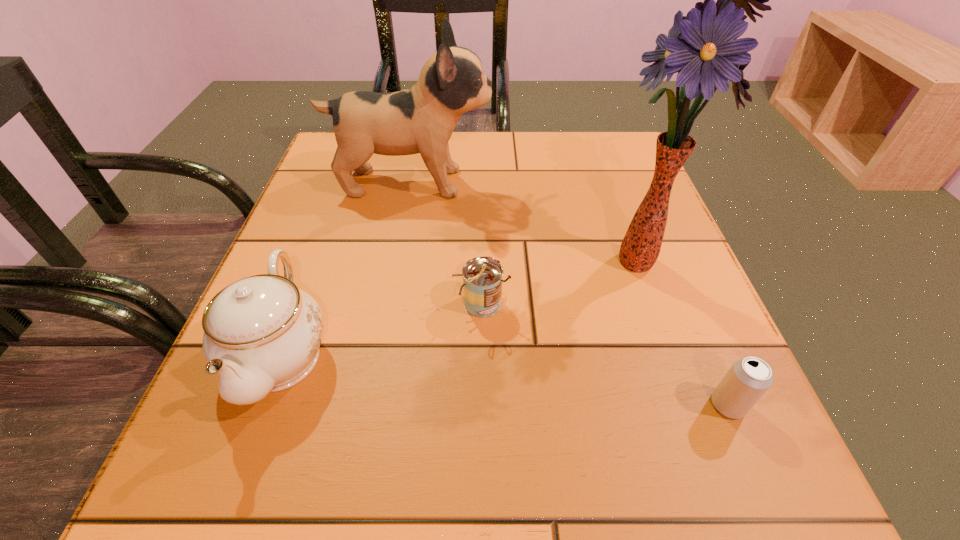
Locate an element on the screen. flower arrangement is located at coordinates (703, 48).

The image size is (960, 540). In order to click on puppy in this screenshot , I will do `click(421, 120)`.

Identify the location of the second tallest object. (421, 120).

Locate an element on the screen. This screenshot has width=960, height=540. chinaware is located at coordinates (262, 334).

Locate an element on the screen. The width and height of the screenshot is (960, 540). can is located at coordinates (482, 276).

I want to click on beer can, so click(748, 379).

The image size is (960, 540). Identify the location of free space located on the left of the tallest object. (465, 259).

I want to click on free space located at the face of the second tallest object, so click(x=557, y=183).

Where is `free space located 0.070m at the spout of the third tallest object`? This screenshot has width=960, height=540. free space located 0.070m at the spout of the third tallest object is located at coordinates (234, 484).

At what (x,y) coordinates should I click in order to perform the action: click on vacant space located on the back of the fourth tallest object. Please return your answer as a coordinate pair (x, y). This screenshot has height=540, width=960. Looking at the image, I should click on (481, 165).